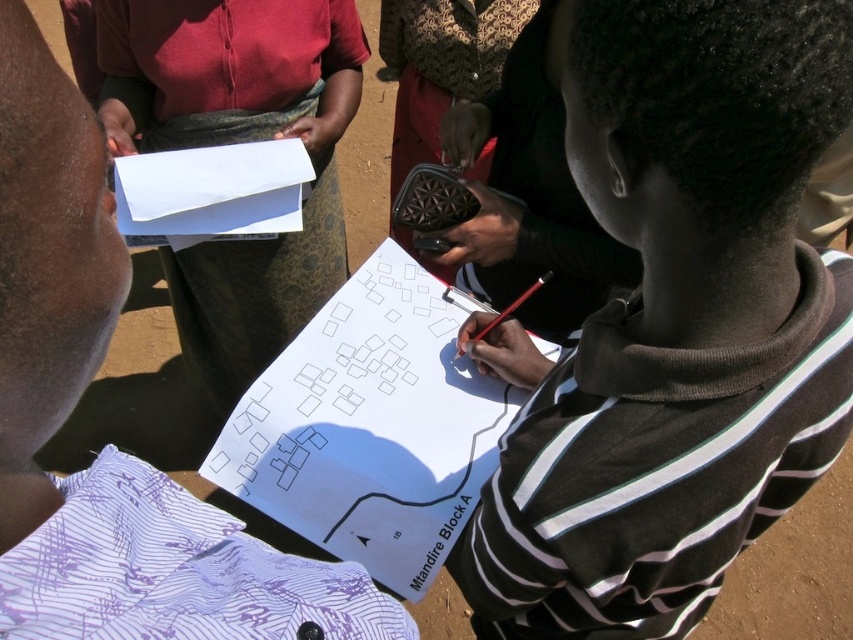
Does point (711, 508) come farther from viewer compared to point (299, 180)?

No, it is in front of (299, 180).

Which is above, black striped hoodie at center or white paper at upper left?

white paper at upper left is above.

This screenshot has height=640, width=853. In order to click on black striped hoodie at center in this screenshot , I will do `click(674, 324)`.

Who is higher up, white paper at center or white paper at lower center?

white paper at center is above.

Which of these two, white paper at center or white paper at lower center, stands taller?

Standing taller between the two is white paper at center.

This screenshot has width=853, height=640. Identify the location of white paper at center. (367, 419).

Where is `white paper at center`? The image size is (853, 640). white paper at center is located at coordinates (367, 419).

Is white paper at center closer to the viewer compared to white paper at upper left?

That is True.

Where is `white paper at center`? The image size is (853, 640). white paper at center is located at coordinates (367, 419).